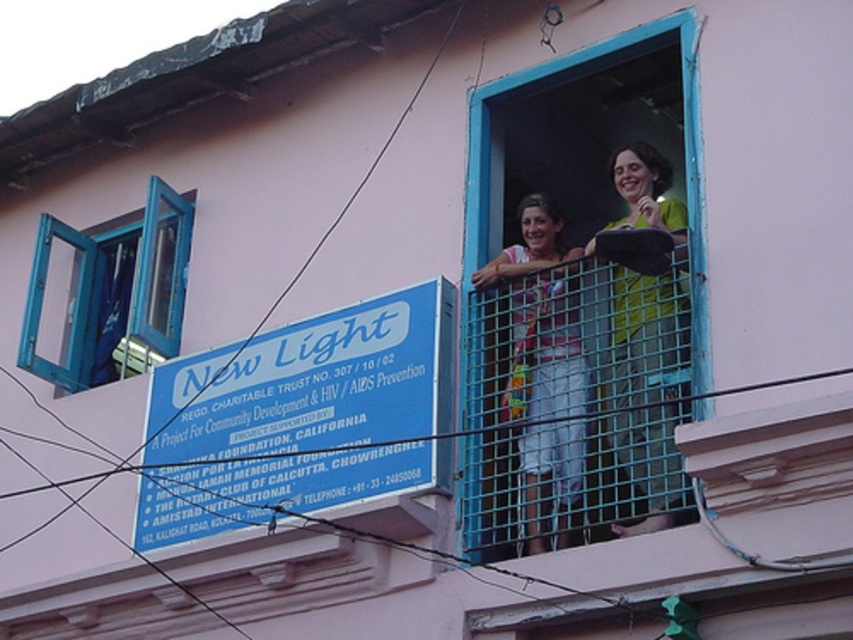
Is point (628, 371) positioned before point (543, 458)?

That is True.

Looking at this image, is green fabric dress at center smaller than matte pink blouse at center?

No.

Identify the location of green fabric dress at center. The width and height of the screenshot is (853, 640). (645, 337).

How distant is blue painted wood window at left from green fabric dress at center?

blue painted wood window at left is 64.08 feet from green fabric dress at center.

Does blue painted wood window at left have a lesser height compared to green fabric dress at center?

Yes.

Is point (170, 188) positioned before point (671, 513)?

That is False.

At what (x,y) coordinates should I click in order to perform the action: click on blue painted wood window at left. Please return your answer as a coordinate pair (x, y). The image size is (853, 640). Looking at the image, I should click on pyautogui.click(x=111, y=294).

Between point (578, 330) and point (561, 353), which one is positioned in front?

Point (578, 330) is more forward.

Between blue metal fence at center and matte pink blouse at center, which one is positioned lower?

Positioned lower is blue metal fence at center.

The height and width of the screenshot is (640, 853). In order to click on blue metal fence at center in this screenshot , I will do `click(572, 396)`.